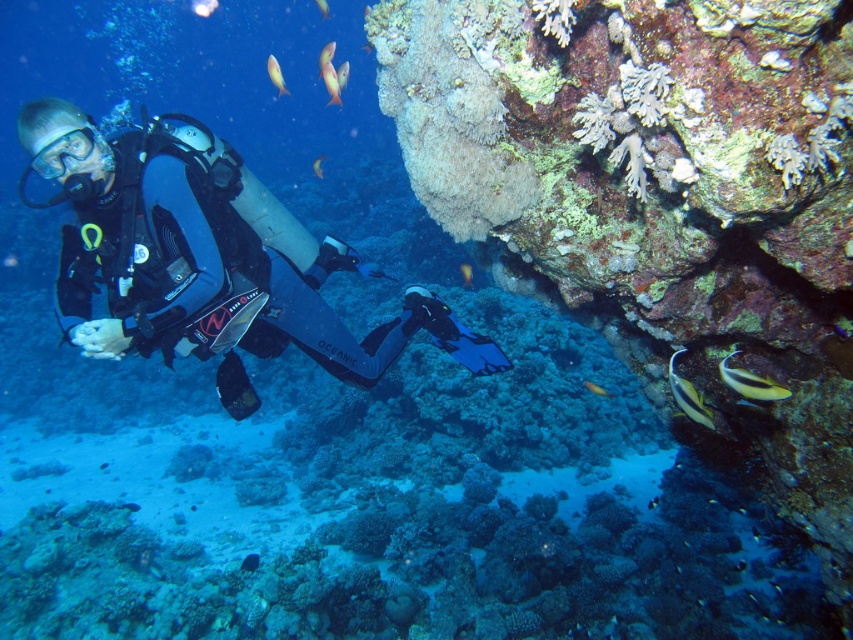
Is orange glossy fish at upper center above shiny yellow fish at lower right?

Yes, orange glossy fish at upper center is above shiny yellow fish at lower right.

Based on the photo, can you confirm if orange glossy fish at upper center is bigger than shiny yellow fish at lower right?

Yes.

Between point (326, 88) and point (608, 394), which one is positioned behind?

The point (326, 88) is more distant.

At what (x,y) coordinates should I click in order to perform the action: click on orange glossy fish at upper center. Please return your answer as a coordinate pair (x, y). Image resolution: width=853 pixels, height=640 pixels. Looking at the image, I should click on (331, 83).

This screenshot has width=853, height=640. What are the coordinates of `yellow and black striped fish at lower right` in the screenshot? It's located at (688, 396).

Which is above, yellow and black striped fish at lower right or shiny silver fish at center?

shiny silver fish at center is above.

Find the location of a particular element. This screenshot has height=640, width=853. yellow and black striped fish at lower right is located at coordinates (688, 396).

Does shiny silver fish at center appear under shiny orange fish at upper center?

Yes, shiny silver fish at center is below shiny orange fish at upper center.

Is shiny silver fish at center to the left of shiny orange fish at upper center from the viewer's perspective?

No, shiny silver fish at center is not to the left of shiny orange fish at upper center.

What do you see at coordinates (318, 164) in the screenshot? This screenshot has width=853, height=640. I see `shiny silver fish at center` at bounding box center [318, 164].

What are the coordinates of `shiny silver fish at center` in the screenshot? It's located at (318, 164).